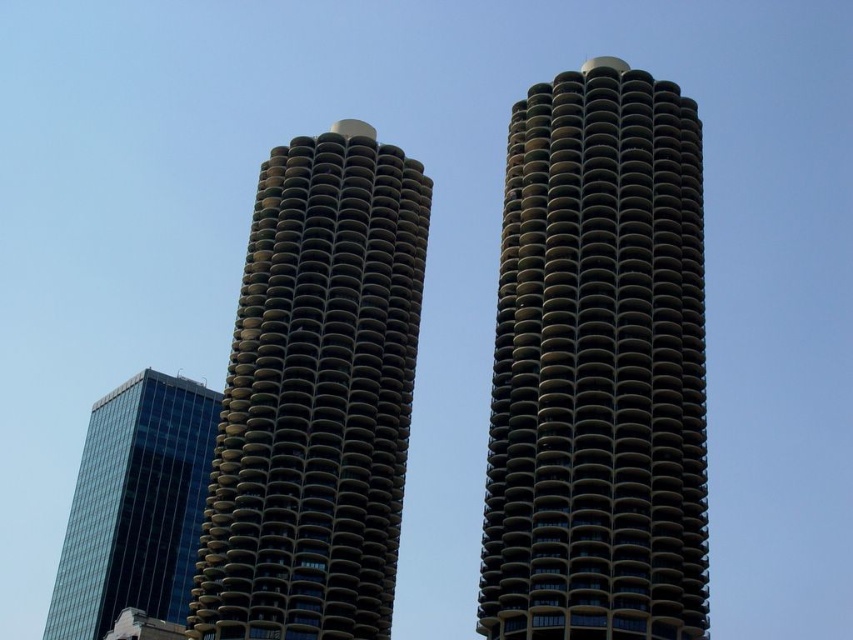
Question: Which point is closer to the camera?

Choices:
 (A) green concrete tower at center
 (B) transparent glass skyscraper at lower left

Answer: (A)

Question: Which object is farther from the camera taking this photo?

Choices:
 (A) dark brown concrete tower at center
 (B) transparent glass skyscraper at lower left
 (C) green concrete tower at center

Answer: (B)

Question: Can you confirm if dark brown concrete tower at center is thinner than green concrete tower at center?

Choices:
 (A) yes
 (B) no

Answer: (B)

Question: Which object appears farthest from the camera in this image?

Choices:
 (A) green concrete tower at center
 (B) dark brown concrete tower at center
 (C) transparent glass skyscraper at lower left

Answer: (C)

Question: Does dark brown concrete tower at center appear under green concrete tower at center?

Choices:
 (A) no
 (B) yes

Answer: (A)

Question: Where is dark brown concrete tower at center located in relation to green concrete tower at center in the image?

Choices:
 (A) above
 (B) below

Answer: (A)